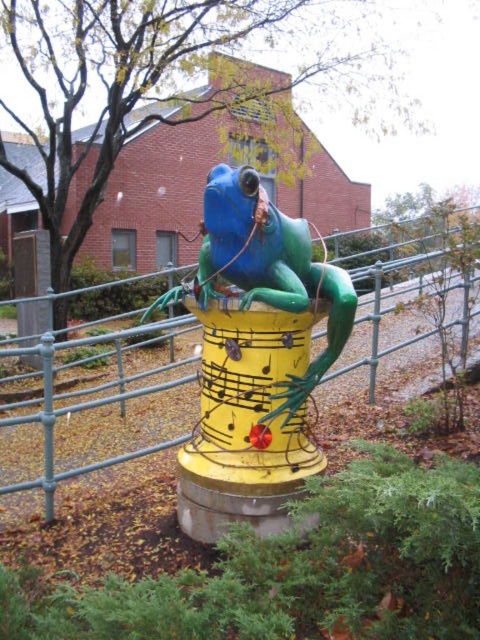
How distant is yellow painted metal at center from shiny blue frog at center?

yellow painted metal at center and shiny blue frog at center are 27.63 centimeters apart.

At what (x,y) coordinates should I click in order to perform the action: click on yellow painted metal at center. Please return your answer as a coordinate pair (x, y). This screenshot has height=640, width=480. Looking at the image, I should click on (245, 420).

Which is behind, point (273, 483) or point (168, 294)?

Point (168, 294)

Where is `yellow painted metal at center`? yellow painted metal at center is located at coordinates (245, 420).

Does yellow painted metal at center have a lesser width compared to green metal fence at center?

Correct, yellow painted metal at center's width is less than green metal fence at center's.

Does yellow painted metal at center have a greater height compared to green metal fence at center?

No.

Measure the distance between point [219,516] and camera.

Point [219,516] is 2.78 meters away from camera.

You are a GUI agent. You are given a task and a screenshot of the screen. Output one action in this format:
    pyautogui.click(x=<x>, y=<y>)
    Task: Click on the yellow painted metal at center
    
    Given the screenshot: What is the action you would take?
    pyautogui.click(x=245, y=420)

Can you confirm if green metal fence at center is thinner than shiny blue frog at center?

No.

Between green metal fence at center and shiny blue frog at center, which one appears on the right side from the viewer's perspective?

Result: shiny blue frog at center is more to the right.

Is point (10, 417) behind point (272, 289)?

Yes.

Identify the location of green metal fence at center. (93, 397).